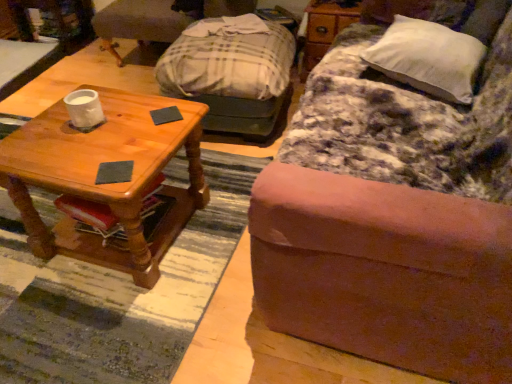
Measure the distance between white soft pillow at upper right and camera.

The distance of white soft pillow at upper right from camera is 4.80 feet.

Describe the element at coordinates (395, 212) in the screenshot. I see `brown fabric couch at right` at that location.

Measure the distance between point (175,114) and camera.

5.07 feet.

Find the location of `plaid fabric swivel chair at center, the first swivel chair from the back`. plaid fabric swivel chair at center, the first swivel chair from the back is located at coordinates (x=158, y=19).

The height and width of the screenshot is (384, 512). In order to click on white soft pillow at upper right in this screenshot , I will do `click(428, 58)`.

From the image's perspective, is brushed metal desk at upper left positioned above or below brown fabric couch at right?

brushed metal desk at upper left is above brown fabric couch at right.

Is brushed metal desk at upper left facing away from brown fabric couch at right?

No, brushed metal desk at upper left is not facing the opposite direction of brown fabric couch at right.

Considering the relative sizes of brushed metal desk at upper left and brown fabric couch at right in the image provided, is brushed metal desk at upper left shorter than brown fabric couch at right?

Yes, brushed metal desk at upper left is shorter than brown fabric couch at right.

Is brushed metal desk at upper left wider than brown fabric couch at right?

Incorrect, the width of brushed metal desk at upper left does not surpass that of brown fabric couch at right.

Is point (26, 14) closer or farther from the camera than point (164, 12)?

Point (26, 14) is positioned farther from the camera compared to point (164, 12).

From a real-world perspective, relative to plaid fabric swivel chair at center, the 2th swivel chair in the front-to-back sequence, is brushed metal desk at upper left vertically above or below?

Clearly, from a real-world perspective, brushed metal desk at upper left is below plaid fabric swivel chair at center, the 2th swivel chair in the front-to-back sequence.

Would you say brushed metal desk at upper left is inside or outside plaid fabric swivel chair at center, the first swivel chair from the back?

brushed metal desk at upper left is located beyond the bounds of plaid fabric swivel chair at center, the first swivel chair from the back.

Based on the photo, is brushed metal desk at upper left not close to plaid fabric swivel chair at center, the 2th swivel chair in the front-to-back sequence?

That's not correct — brushed metal desk at upper left is a little close to plaid fabric swivel chair at center, the 2th swivel chair in the front-to-back sequence.

What's the angular difference between white marble cup at center left and brushed metal desk at upper left's facing directions?

There is a 94.1-degree angle between the facing directions of white marble cup at center left and brushed metal desk at upper left.

Is point (100, 120) farther from camera compared to point (6, 93)?

No, it is not.

Does white marble cup at center left have a smaller size compared to brushed metal desk at upper left?

Correct, white marble cup at center left occupies less space than brushed metal desk at upper left.

Choose the correct answer: Is white marble cup at center left inside brushed metal desk at upper left or outside it?

white marble cup at center left is located beyond the bounds of brushed metal desk at upper left.

Considering the sizes of plaid fabric ottoman at center, the 1th swivel chair from the front, and brown fabric couch at right in the image, is plaid fabric ottoman at center, the 1th swivel chair from the front, wider or thinner than brown fabric couch at right?

Clearly, plaid fabric ottoman at center, the 1th swivel chair from the front, has less width compared to brown fabric couch at right.

Considering the sizes of plaid fabric ottoman at center, acting as the 2th swivel chair starting from the back, and brown fabric couch at right in the image, is plaid fabric ottoman at center, acting as the 2th swivel chair starting from the back, taller or shorter than brown fabric couch at right?

plaid fabric ottoman at center, acting as the 2th swivel chair starting from the back, is shorter than brown fabric couch at right.

From the image's perspective, which object appears higher, plaid fabric ottoman at center, the 1th swivel chair from the front, or brown fabric couch at right?

plaid fabric ottoman at center, the 1th swivel chair from the front, from the image's perspective.

Considering the sizes of objects plaid fabric ottoman at center, acting as the 2th swivel chair starting from the back, and brown fabric couch at right in the image provided, who is smaller, plaid fabric ottoman at center, acting as the 2th swivel chair starting from the back, or brown fabric couch at right?

plaid fabric ottoman at center, acting as the 2th swivel chair starting from the back.

Consider the image. Between plaid fabric swivel chair at center, the 2th swivel chair in the front-to-back sequence, and dark gray matte coaster at center, which is the 2th pad in bottom-to-top order, which one appears on the right side from the viewer's perspective?

dark gray matte coaster at center, which is the 2th pad in bottom-to-top order, is more to the right.

From a real-world perspective, starting from the dark gray matte coaster at center, the 2th pad in the front-to-back sequence, which swivel chair is the 1st one below it? Please provide its 2D coordinates.

[(158, 19)]

Is plaid fabric swivel chair at center, the 2th swivel chair in the front-to-back sequence, further to camera compared to dark gray matte coaster at center, acting as the 1th pad starting from the top?

Yes, it is.

Consider the image. Is gray felt coaster at center, which is the 2th pad from top to bottom, looking in the opposite direction of white soft pillow at upper right?

gray felt coaster at center, which is the 2th pad from top to bottom, is not turned away from white soft pillow at upper right.

From a real-world perspective, which object rests below the other?

gray felt coaster at center, marked as the first pad in a front-to-back arrangement.

Is point (120, 174) behind point (364, 57)?

No.

What's the angular difference between gray felt coaster at center, which is the 2th pad from top to bottom, and plaid fabric ottoman at center, acting as the 2th swivel chair starting from the back,'s facing directions?

The facing directions of gray felt coaster at center, which is the 2th pad from top to bottom, and plaid fabric ottoman at center, acting as the 2th swivel chair starting from the back, are 110 degrees apart.

Is gray felt coaster at center, marked as the first pad in a front-to-back arrangement, far from plaid fabric ottoman at center, acting as the 2th swivel chair starting from the back?

A: Yes, gray felt coaster at center, marked as the first pad in a front-to-back arrangement, and plaid fabric ottoman at center, acting as the 2th swivel chair starting from the back, are quite far apart.

Between gray felt coaster at center, marked as the first pad in a front-to-back arrangement, and plaid fabric ottoman at center, the 1th swivel chair from the front, which one appears on the right side from the viewer's perspective?

plaid fabric ottoman at center, the 1th swivel chair from the front, is more to the right.

Considering the sizes of objects gray felt coaster at center, arranged as the second pad when viewed from the back, and plaid fabric ottoman at center, acting as the 2th swivel chair starting from the back, in the image provided, who is bigger, gray felt coaster at center, arranged as the second pad when viewed from the back, or plaid fabric ottoman at center, acting as the 2th swivel chair starting from the back,?

With larger size is plaid fabric ottoman at center, acting as the 2th swivel chair starting from the back.

The height and width of the screenshot is (384, 512). Find the location of `desk behind the brown fabric couch at right`. desk behind the brown fabric couch at right is located at coordinates (56, 32).

From the brushed metal desk at upper left, count 1st swivel chairs forward and point to it. Please provide its 2D coordinates.

[(158, 19)]

When comparing their distances from wooden coffee table at left, does white marble cup at center left or brushed metal desk at upper left seem closer?

white marble cup at center left lies closer to wooden coffee table at left than the other object.

Based on their spatial positions, is gray felt coaster at center, which is the 2th pad from top to bottom, or plaid fabric swivel chair at center, the 2th swivel chair in the front-to-back sequence, closer to plaid fabric ottoman at center, acting as the 2th swivel chair starting from the back?

plaid fabric swivel chair at center, the 2th swivel chair in the front-to-back sequence, is closer to plaid fabric ottoman at center, acting as the 2th swivel chair starting from the back.

Estimate the real-world distances between objects in this image. Which object is closer to plaid fabric swivel chair at center, the first swivel chair from the back, wooden dresser at upper right or wooden coffee table at left?

Based on the image, wooden dresser at upper right appears to be nearer to plaid fabric swivel chair at center, the first swivel chair from the back.

From the image, which object appears to be nearer to white soft pillow at upper right, wooden dresser at upper right or brushed metal desk at upper left?

wooden dresser at upper right is positioned closer to the anchor white soft pillow at upper right.

Estimate the real-world distances between objects in this image. Which object is further from dark gray matte coaster at center, which is the 1th pad from back to front, plaid fabric swivel chair at center, the 2th swivel chair in the front-to-back sequence, or gray felt coaster at center, which appears as the 1th pad when ordered from the bottom?

Based on the image, plaid fabric swivel chair at center, the 2th swivel chair in the front-to-back sequence, appears to be further to dark gray matte coaster at center, which is the 1th pad from back to front.

Looking at the image, which one is located further to white soft pillow at upper right, plaid fabric swivel chair at center, the first swivel chair from the back, or dark gray matte coaster at center, which is the 1th pad from back to front?

Based on the image, plaid fabric swivel chair at center, the first swivel chair from the back, appears to be further to white soft pillow at upper right.

Which object lies further to the anchor point wooden coffee table at left, white soft pillow at upper right or plaid fabric swivel chair at center, the first swivel chair from the back?

Based on the image, plaid fabric swivel chair at center, the first swivel chair from the back, appears to be further to wooden coffee table at left.

Considering their positions, is white soft pillow at upper right positioned closer to plaid fabric swivel chair at center, the first swivel chair from the back, than brushed metal desk at upper left?

Among the two, brushed metal desk at upper left is located nearer to plaid fabric swivel chair at center, the first swivel chair from the back.

At what (x,y) coordinates should I click in order to perform the action: click on coffee cup between wooden coffee table at left and dark gray matte coaster at center, the 2th pad in the front-to-back sequence, from front to back. Please return your answer as a coordinate pair (x, y). This screenshot has height=384, width=512. Looking at the image, I should click on (84, 109).

Identify the location of coffee cup between brushed metal desk at upper left and wooden dresser at upper right from left to right. The width and height of the screenshot is (512, 384). (84, 109).

Locate an element on the screen. This screenshot has width=512, height=384. coffee cup between gray felt coaster at center, arranged as the second pad when viewed from the back, and wooden dresser at upper right in the front-back direction is located at coordinates (84, 109).

Image resolution: width=512 pixels, height=384 pixels. Identify the location of pad located between gray felt coaster at center, which appears as the 1th pad when ordered from the bottom, and plaid fabric swivel chair at center, the 2th swivel chair in the front-to-back sequence, in the depth direction. (166, 115).